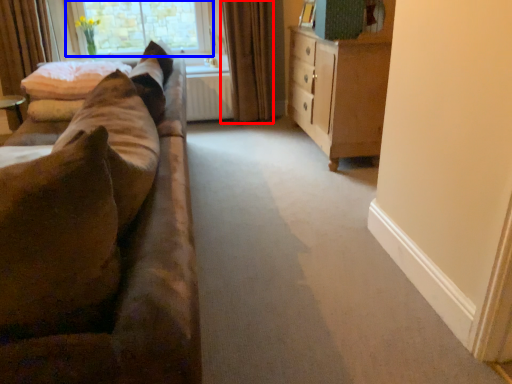
Question: Among these objects, which one is nearest to the camera, curtain (highlighted by a red box) or window (highlighted by a blue box)?

Choices:
 (A) curtain
 (B) window

Answer: (A)